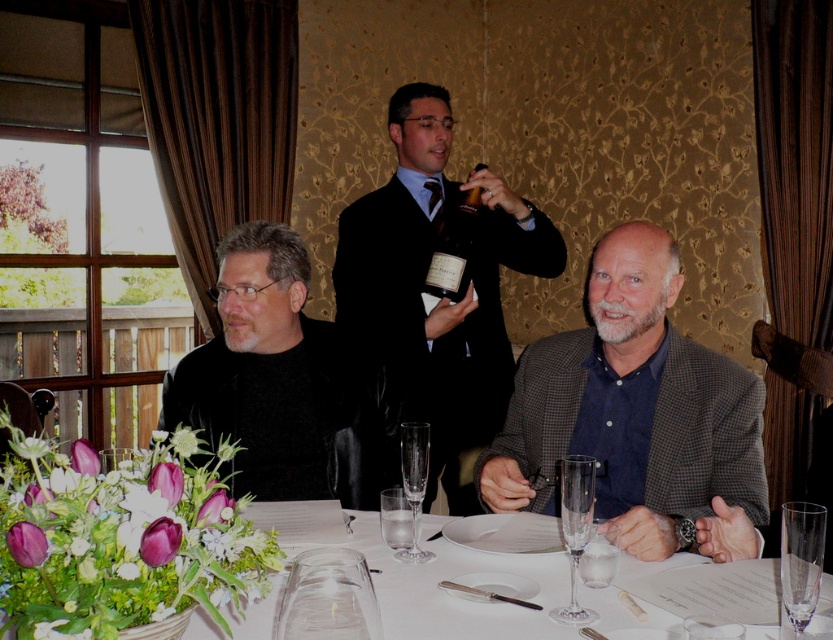
You are a photographer standing at the camera position. You want to place the shiny dark brown bottle at center closer to the camera without moving the camera. How much distance do you need to move the bottle to make it 6 feet away from the camera?

The shiny dark brown bottle at center is currently 8.36 feet away from the camera. To move it to 6 feet away, you need to move it closer by 2.36 feet.

You are a server at the banquet and need to retrieve the clear glass wine glass at center for a toast. Can you reach it without moving the shiny dark brown bottle at center?

The clear glass wine glass at center is behind the shiny dark brown bottle at center, so you cannot reach it without moving the bottle.